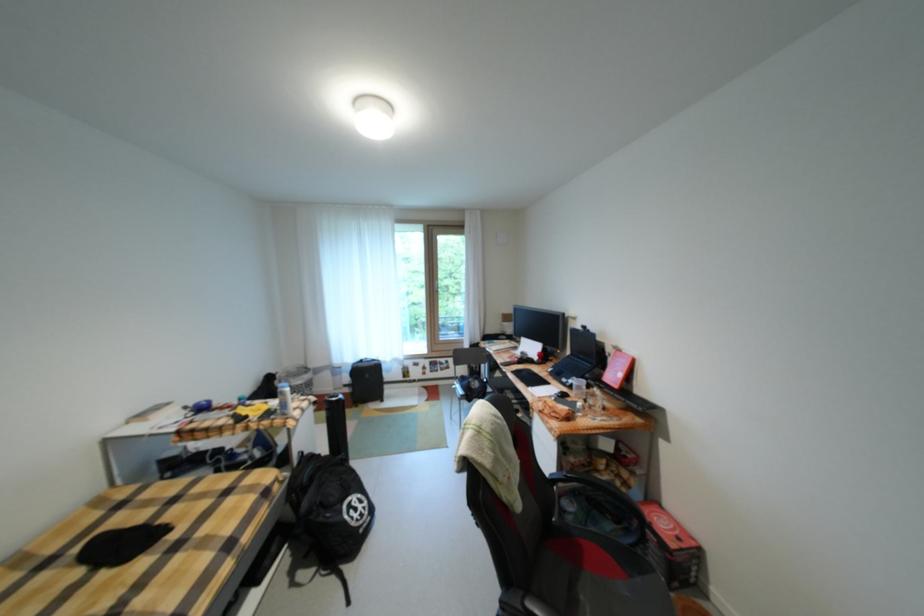
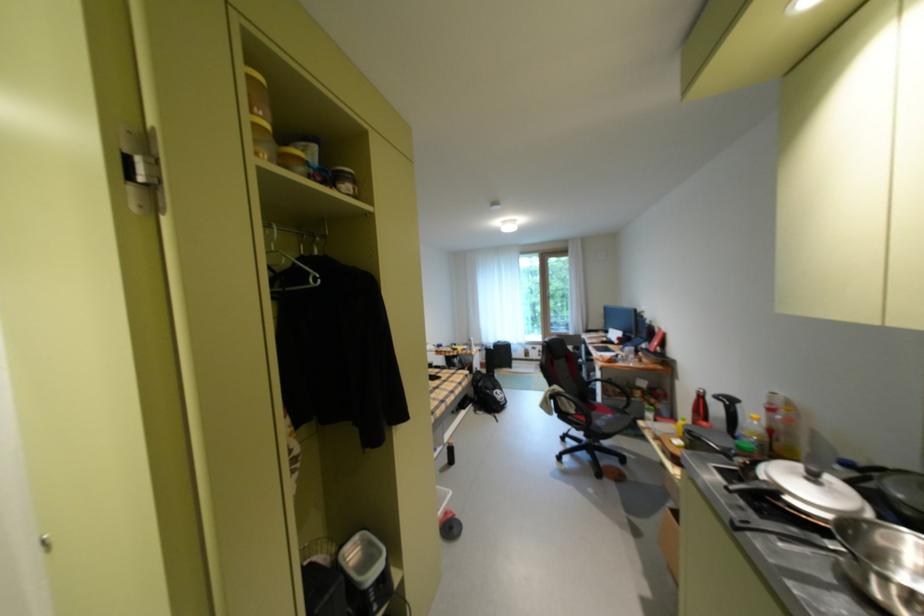
Question: The images are taken continuously from a first-person perspective. In which direction are you moving?

Choices:
 (A) Left
 (B) Right
 (C) Forward
 (D) Backward

Answer: (D)